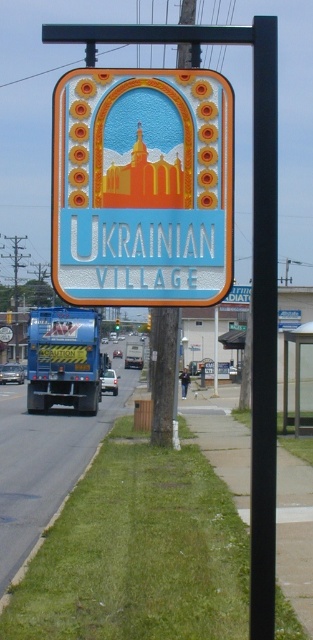
Question: Is black metal pole at center to the left of neon yellow truck at lower left from the viewer's perspective?

Choices:
 (A) no
 (B) yes

Answer: (A)

Question: Considering the relative positions of matte orange neon sign at upper center and neon yellow truck at lower left in the image provided, where is matte orange neon sign at upper center located with respect to neon yellow truck at lower left?

Choices:
 (A) left
 (B) right

Answer: (B)

Question: Can you confirm if matte orange neon sign at upper center is smaller than neon yellow truck at lower left?

Choices:
 (A) no
 (B) yes

Answer: (B)

Question: Which point is farther to the camera?

Choices:
 (A) (90, 376)
 (B) (122, 104)

Answer: (A)

Question: Which of the following is the farthest from the observer?

Choices:
 (A) matte orange neon sign at upper center
 (B) neon yellow truck at lower left

Answer: (B)

Question: Estimate the real-world distances between objects in this image. Which object is closer to the black metal pole at center?

Choices:
 (A) neon yellow truck at lower left
 (B) matte orange neon sign at upper center

Answer: (B)